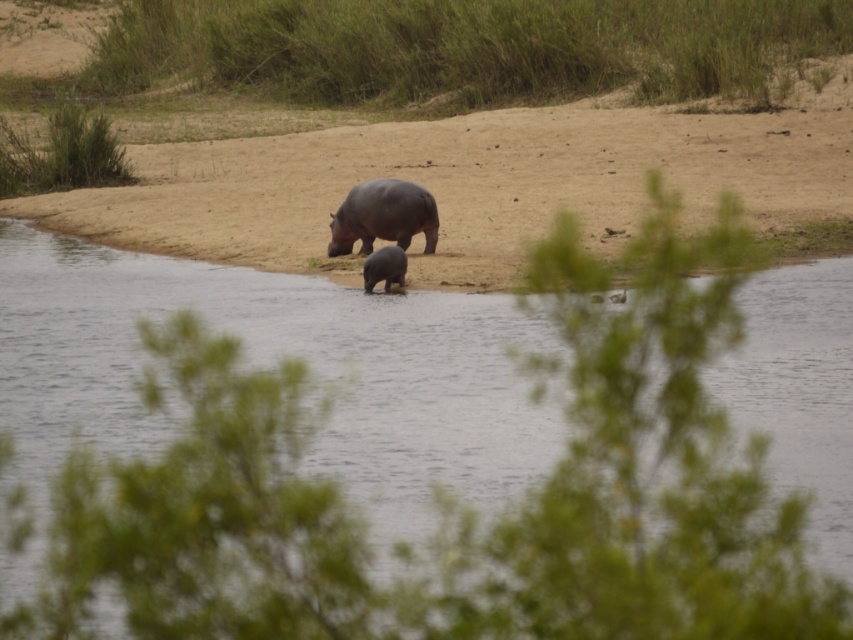
Does dark gray matte hippo at center have a smaller size compared to gray matte elephant at center?

No, dark gray matte hippo at center is not smaller than gray matte elephant at center.

Between dark gray matte hippo at center and gray matte elephant at center, which one has more height?

With more height is dark gray matte hippo at center.

The width and height of the screenshot is (853, 640). I want to click on dark gray matte hippo at center, so [383, 216].

Is clear water at river center below dark gray matte hippo at center?

Yes.

Does clear water at river center appear over dark gray matte hippo at center?

No.

Locate an element on the screen. The height and width of the screenshot is (640, 853). clear water at river center is located at coordinates (270, 356).

Where is `clear water at river center`? clear water at river center is located at coordinates (270, 356).

Is point (358, 388) behind point (392, 252)?

No, (358, 388) is closer to viewer.

Is clear water at river center positioned at the back of gray matte elephant at center?

No, it is not.

Identify the location of clear water at river center. Image resolution: width=853 pixels, height=640 pixels. (270, 356).